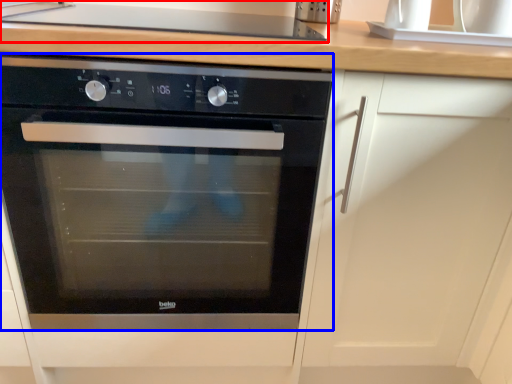
Question: Among these objects, which one is nearest to the camera, gas stove (highlighted by a red box) or oven (highlighted by a blue box)?

Choices:
 (A) gas stove
 (B) oven

Answer: (B)